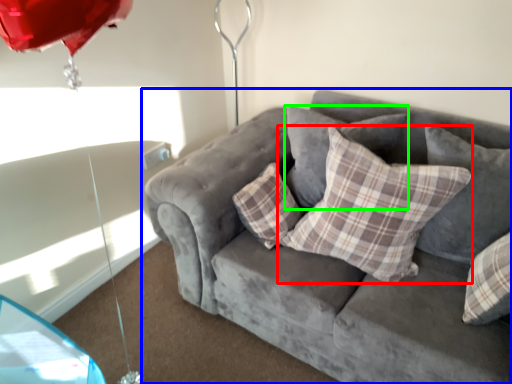
Question: Estimate the real-world distances between objects in this image. Which object is farther from pillow (highlighted by a red box), studio couch (highlighted by a blue box) or pillow (highlighted by a green box)?

Choices:
 (A) studio couch
 (B) pillow

Answer: (B)